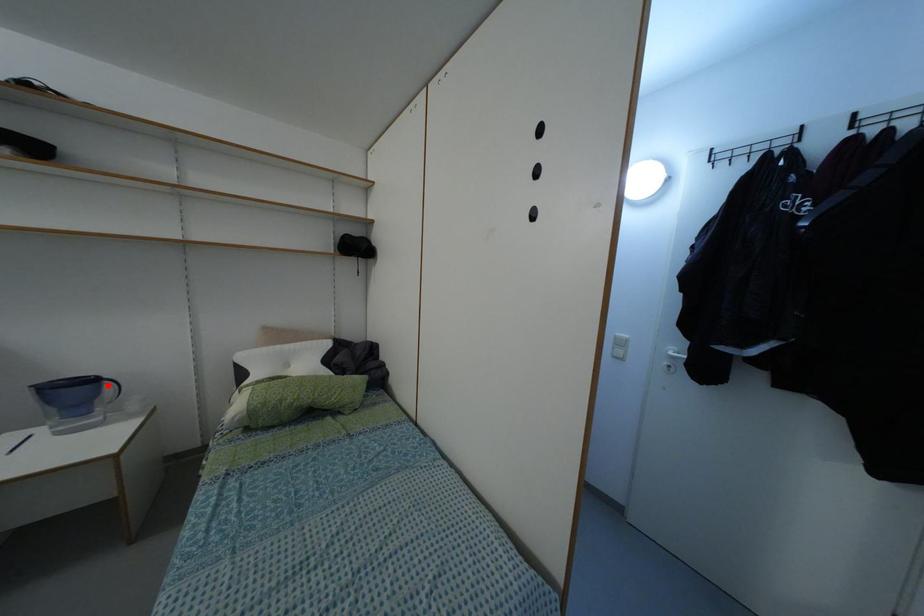
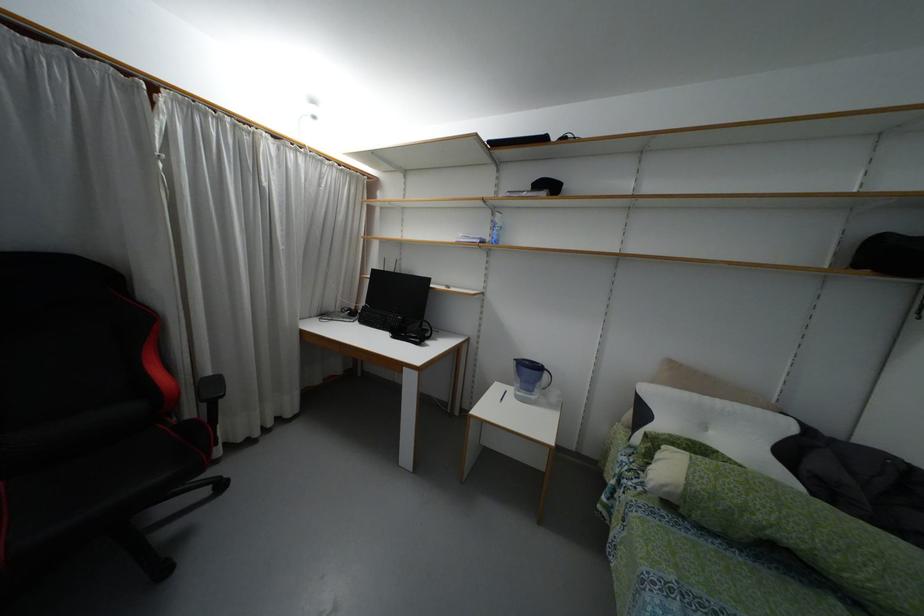
The point at the highlighted location is marked in the first image. Where is the corresponding point in the second image?

(544, 375)